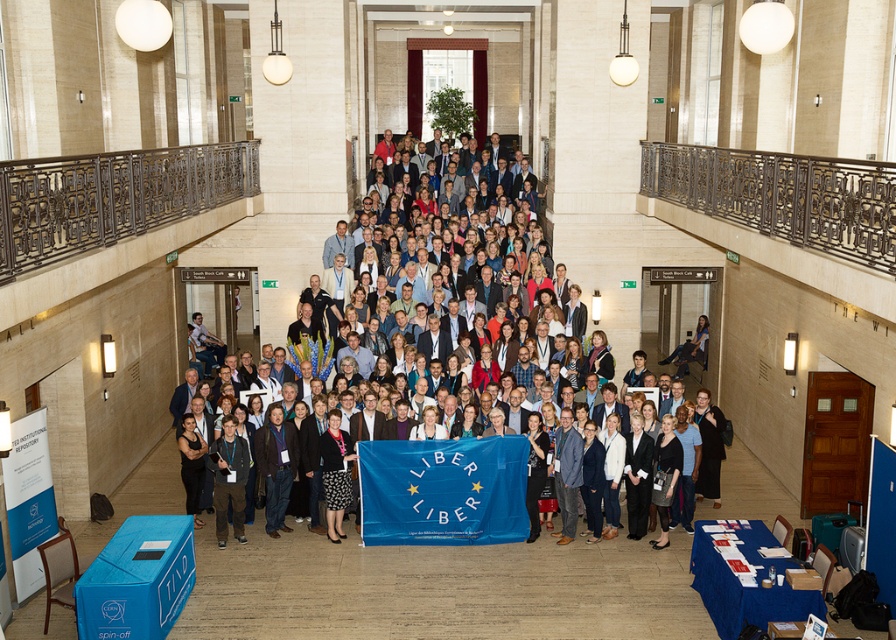
Question: Which object is closer to the camera taking this photo?

Choices:
 (A) blue fabric flag at center
 (B) blue fabric banner at center

Answer: (A)

Question: Which object is farther from the camera taking this photo?

Choices:
 (A) blue fabric banner at center
 (B) blue fabric flag at center

Answer: (A)

Question: Is blue fabric banner at center positioned behind blue fabric flag at center?

Choices:
 (A) no
 (B) yes

Answer: (B)

Question: Does blue fabric banner at center have a larger size compared to blue fabric flag at center?

Choices:
 (A) yes
 (B) no

Answer: (A)

Question: Is blue fabric banner at center above blue fabric flag at center?

Choices:
 (A) yes
 (B) no

Answer: (A)

Question: Which object appears farthest from the camera in this image?

Choices:
 (A) blue fabric flag at center
 (B) blue fabric banner at center

Answer: (B)